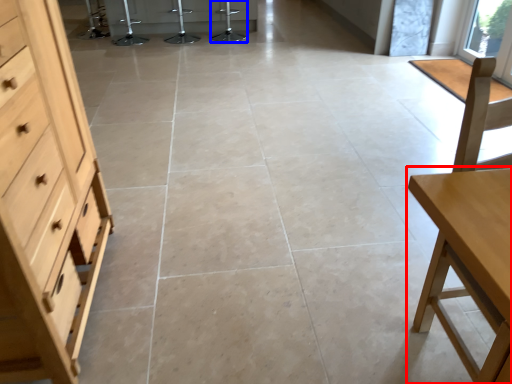
Question: Which object is further to the camera taking this photo, table (highlighted by a red box) or bar stool (highlighted by a blue box)?

Choices:
 (A) table
 (B) bar stool

Answer: (B)